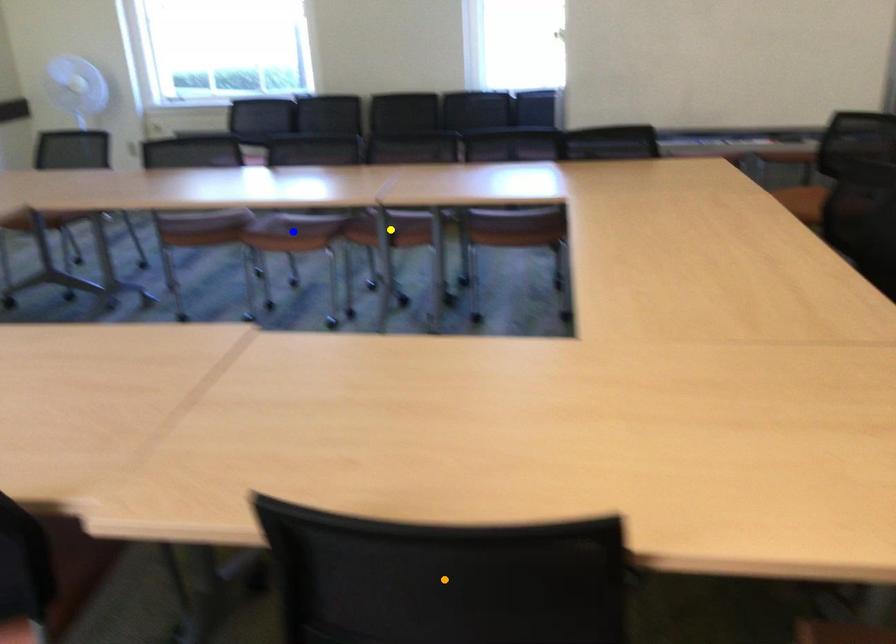
Order these from farthest to nearest:
blue point, orange point, yellow point

blue point < yellow point < orange point